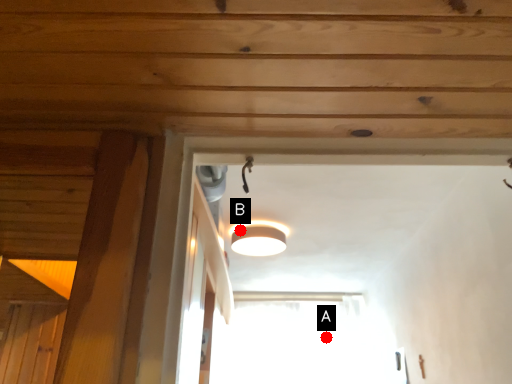
Question: Two points are circled on the image, labeled by A and B beside each circle. Which point is closer to the camera?

Choices:
 (A) A is closer
 (B) B is closer

Answer: (B)